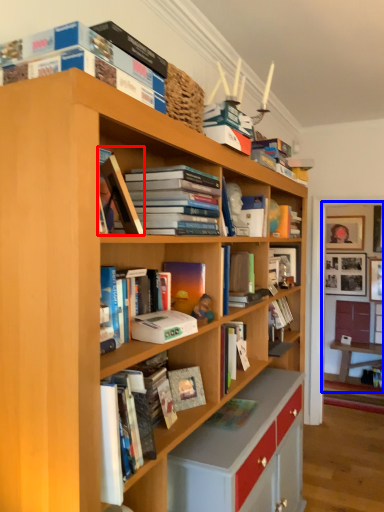
Question: Among these objects, which one is farthest to the camera, book (highlighted by a red box) or bookstore (highlighted by a blue box)?

Choices:
 (A) book
 (B) bookstore

Answer: (B)